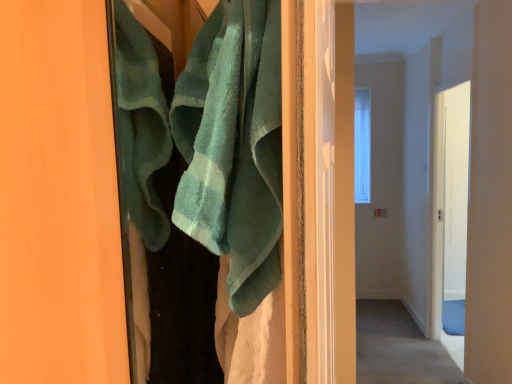
Find the location of `teal terry cloth towel at center`. teal terry cloth towel at center is located at coordinates (234, 145).

What do you see at coordinates (234, 145) in the screenshot?
I see `teal terry cloth towel at center` at bounding box center [234, 145].

What is the approximate height of teal terry cloth towel at center?

It is 16.52 inches.

Find the location of a particular element. The image size is (512, 384). teal terry cloth towel at center is located at coordinates (234, 145).